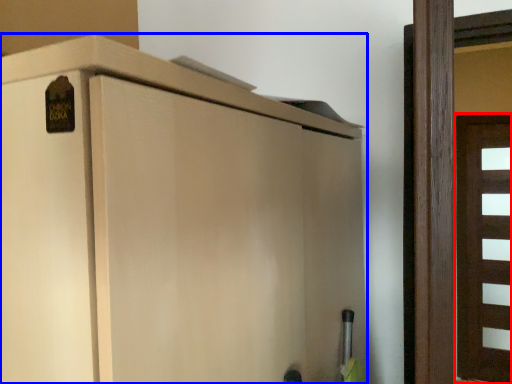
Question: Which object appears farthest to the camera in this image, door (highlighted by a red box) or cupboard (highlighted by a blue box)?

Choices:
 (A) door
 (B) cupboard

Answer: (A)